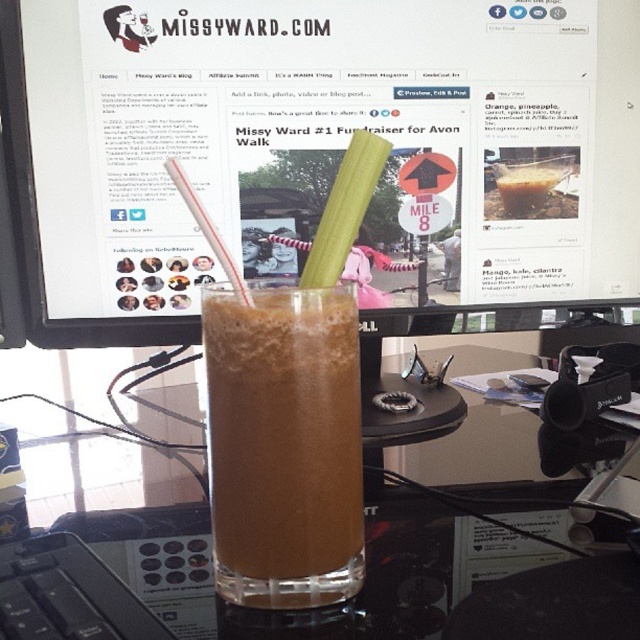
Which is above, green crisp celery at center or translucent plastic straw at center?

green crisp celery at center

Can you confirm if green crisp celery at center is bigger than translucent plastic straw at center?

Incorrect, green crisp celery at center is not larger than translucent plastic straw at center.

Between point (317, 285) and point (212, 227), which one is positioned in front?

Point (212, 227) is more forward.

Identify the location of green crisp celery at center. (344, 209).

Does translucent plastic cup at center come in front of brown frothy drink at center?

That is True.

Is the position of translucent plastic cup at center more distant than that of brown frothy drink at center?

No, it is not.

Which is behind, point (90, 355) or point (236, 557)?

The point (90, 355) is more distant.

Identify the location of translucent plastic cup at center. (209, 545).

Which is above, matte plastic computer monitor at center or translucent plastic cup at center?

matte plastic computer monitor at center is above.

The image size is (640, 640). Describe the element at coordinates (317, 150) in the screenshot. I see `matte plastic computer monitor at center` at that location.

What are the coordinates of `matte plastic computer monitor at center` in the screenshot? It's located at (317, 150).